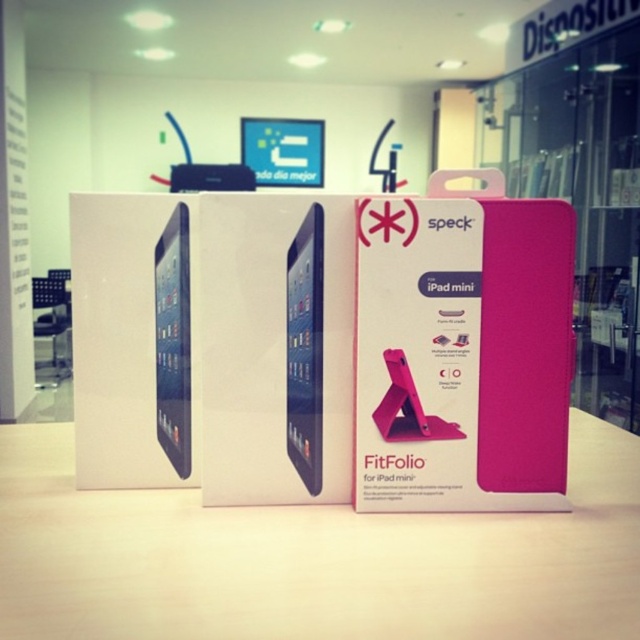
In the scene shown: You are a customer in the store and want to know which of the two points, point (x=291, y=266) or point (x=186, y=316), is closer to you. Based on the image, which one is nearer?

Point (x=291, y=266) is closer to the viewer than point (x=186, y=316).

You are a customer in a store and want to know if the pink matte table at center and the matte black tablet at center are close enough to each other for you to comfortably reach both while standing. The average comfortable reaching distance for most adults is about 12 inches. Can you comfortably reach both items?

The pink matte table at center is 7.94 inches away from the matte black tablet at center, which is within the average comfortable reaching distance of 12 inches. Yes, you can comfortably reach both items.

What are the coordinates of the matte black tablet at center in the image?

The matte black tablet at center is located at coordinates point (305, 349).